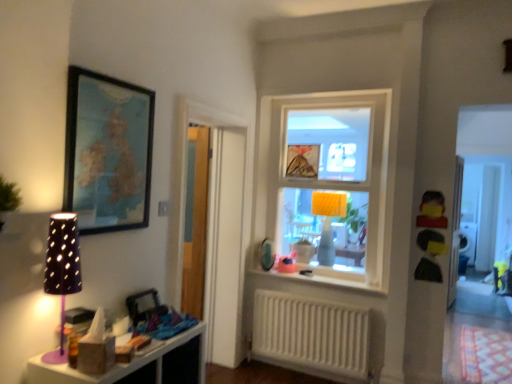
Question: Based on their sizes in the image, would you say matte plastic toy at center, acting as the second toy starting from the top, is bigger or smaller than clear glass window at center?

Choices:
 (A) big
 (B) small

Answer: (B)

Question: From a real-world perspective, is matte plastic toy at center, positioned as the first toy in bottom-to-top order, positioned above or below clear glass window at center?

Choices:
 (A) below
 (B) above

Answer: (A)

Question: Which object is the closest to the purple matte table lamp at left, which is the 1th table lamp from front to back?

Choices:
 (A) yellow matte toy at right, the 1th toy positioned from the front
 (B) transparent wooden door at left
 (C) white glossy window sill at center
 (D) clear glass window at center
 (E) wooden framed map at upper left

Answer: (E)

Question: Based on their relative distances, which object is farther from the matte plastic toy at center, positioned as the first toy in back-to-front order?

Choices:
 (A) white plastic radiator at lower center
 (B) yellow matte toy at right, which is counted as the second toy, starting from the bottom
 (C) white glossy window sill at center
 (D) wooden framed map at upper left
 (E) transparent wooden door at left

Answer: (D)